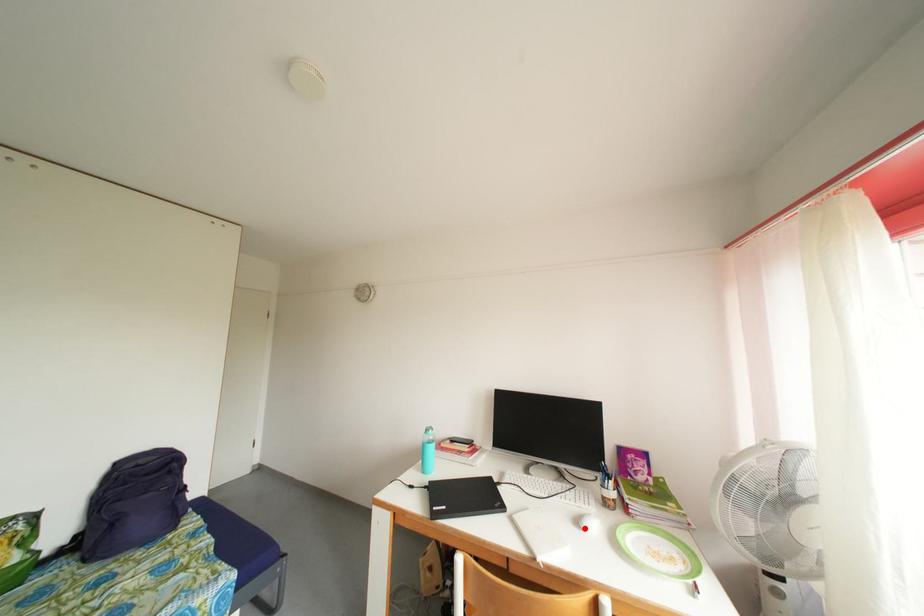
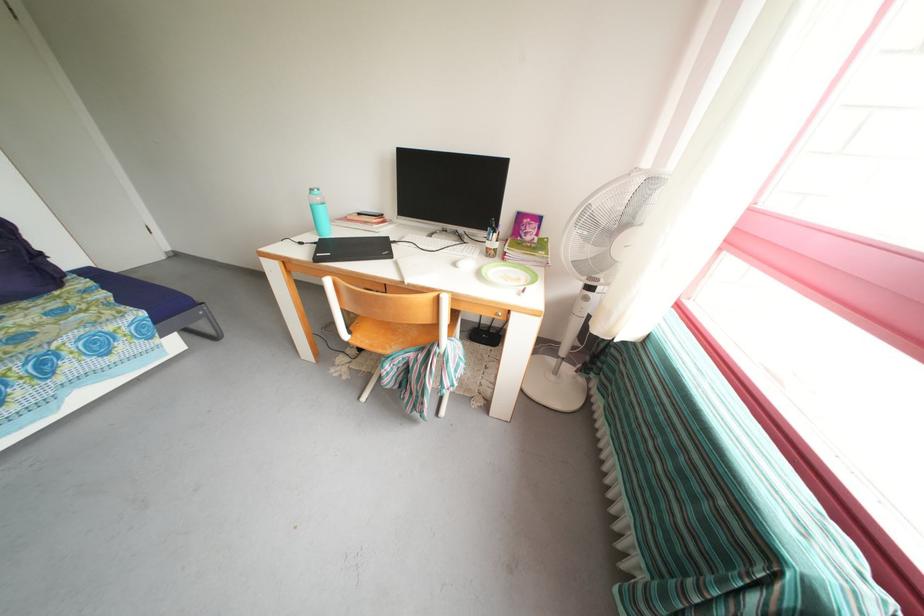
Find the pixel in the second image that matches the highlighted location in the first image.

(462, 269)